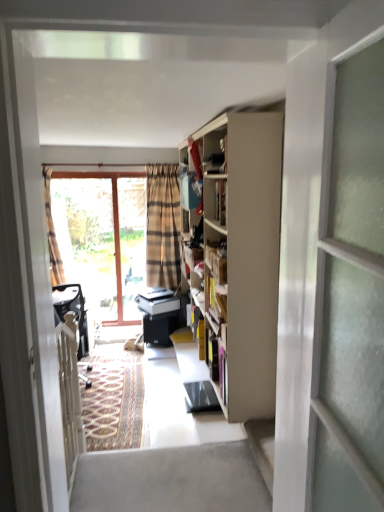
Question: Does plaid fabric curtain at left have a lesser height compared to transparent glass screen door at right?

Choices:
 (A) no
 (B) yes

Answer: (A)

Question: Is plaid fabric curtain at left looking in the opposite direction of transparent glass screen door at right?

Choices:
 (A) yes
 (B) no

Answer: (B)

Question: Does plaid fabric curtain at left have a smaller size compared to transparent glass screen door at right?

Choices:
 (A) yes
 (B) no

Answer: (A)

Question: Is plaid fabric curtain at left next to transparent glass screen door at right?

Choices:
 (A) no
 (B) yes

Answer: (A)

Question: Is plaid fabric curtain at left to the left of transparent glass screen door at right from the viewer's perspective?

Choices:
 (A) no
 (B) yes

Answer: (B)

Question: From the image's perspective, is plaid fabric curtain at left on transparent glass screen door at right?

Choices:
 (A) yes
 (B) no

Answer: (A)

Question: Considering the relative sizes of matte wooden cabinet at upper center and transparent glass screen door at right in the image provided, is matte wooden cabinet at upper center smaller than transparent glass screen door at right?

Choices:
 (A) no
 (B) yes

Answer: (B)

Question: From a real-world perspective, is matte wooden cabinet at upper center beneath transparent glass screen door at right?

Choices:
 (A) yes
 (B) no

Answer: (B)

Question: Considering the relative sizes of matte wooden cabinet at upper center and transparent glass screen door at right in the image provided, is matte wooden cabinet at upper center taller than transparent glass screen door at right?

Choices:
 (A) yes
 (B) no

Answer: (B)

Question: Does matte wooden cabinet at upper center appear on the right side of transparent glass screen door at right?

Choices:
 (A) yes
 (B) no

Answer: (B)

Question: Can you confirm if matte wooden cabinet at upper center is positioned to the left of transparent glass screen door at right?

Choices:
 (A) yes
 (B) no

Answer: (A)

Question: Is transparent glass screen door at right at the back of matte wooden cabinet at upper center?

Choices:
 (A) yes
 (B) no

Answer: (B)

Question: Is translucent glass window at left far away from plaid fabric curtain at left?

Choices:
 (A) no
 (B) yes

Answer: (A)